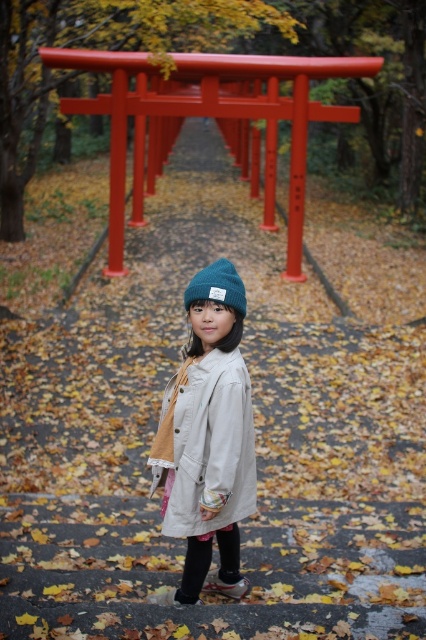
What do you see at coordinates (207, 440) in the screenshot?
I see `matte beige coat at center` at bounding box center [207, 440].

Looking at this image, is the position of matte beige coat at center less distant than that of knitted woolen beanie at center?

That is True.

Locate an element on the screen. The image size is (426, 640). matte beige coat at center is located at coordinates (207, 440).

Identify the location of matte beige coat at center. The width and height of the screenshot is (426, 640). (207, 440).